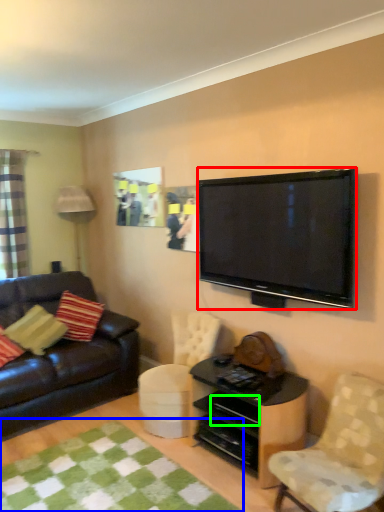
Question: Considering the real-world distances, which object is farthest from television (highlighted by a red box)? mat (highlighted by a blue box) or drawer (highlighted by a green box)?

Choices:
 (A) mat
 (B) drawer

Answer: (A)